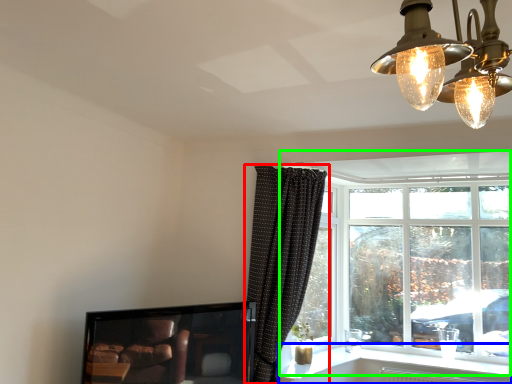
Question: Considering the real-world distances, which object is closest to curtain (highlighted by a red box)? window sill (highlighted by a blue box) or window (highlighted by a green box).

Choices:
 (A) window sill
 (B) window

Answer: (A)